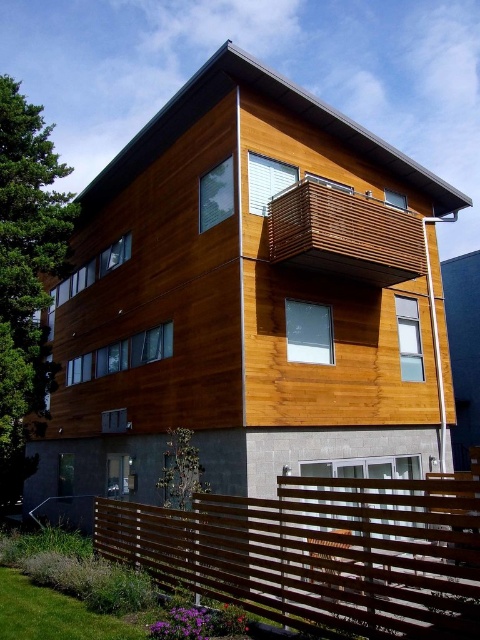
Describe the element at coordinates (320, 552) in the screenshot. I see `brown wooden fence at lower center` at that location.

Is brown wooden fence at lower center below wooden slats balcony at upper center?

Yes, brown wooden fence at lower center is below wooden slats balcony at upper center.

The width and height of the screenshot is (480, 640). In order to click on brown wooden fence at lower center in this screenshot , I will do `click(320, 552)`.

Locate an element on the screen. Image resolution: width=480 pixels, height=640 pixels. brown wooden fence at lower center is located at coordinates (320, 552).